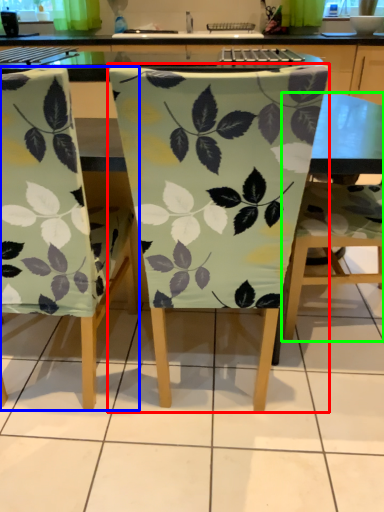
Question: Based on their relative distances, which object is nearer to chair (highlighted by a red box)? Choose from chair (highlighted by a blue box) and chair (highlighted by a green box).

Choices:
 (A) chair
 (B) chair

Answer: (A)